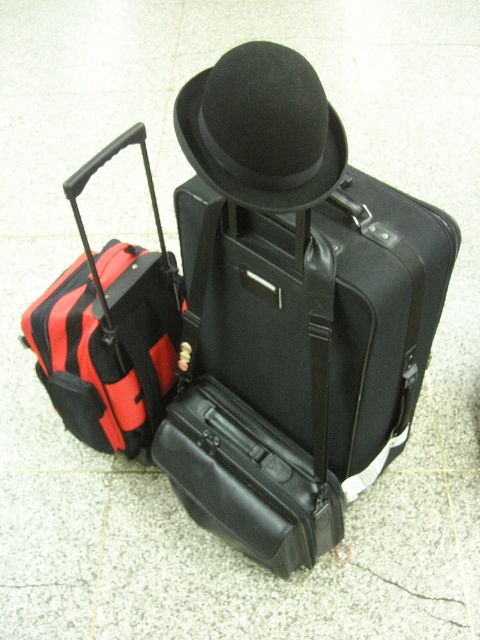
Who is more distant from viewer, (193,442) or (156,346)?

Positioned behind is point (156,346).

Is black leather suitcase at center to the right of red/black striped suitcase at left from the viewer's perspective?

Yes, black leather suitcase at center is to the right of red/black striped suitcase at left.

At what (x,y) coordinates should I click in order to perform the action: click on black leather suitcase at center. Please return your answer as a coordinate pair (x, y). The image size is (480, 640). Looking at the image, I should click on (253, 381).

The width and height of the screenshot is (480, 640). What are the coordinates of `black leather suitcase at center` in the screenshot? It's located at (253, 381).

Does black matte suitcase at center have a greater height compared to black leather suitcase at center?

No.

Which is more to the left, black matte suitcase at center or black leather suitcase at center?

black leather suitcase at center

This screenshot has width=480, height=640. What are the coordinates of `black matte suitcase at center` in the screenshot? It's located at (321, 310).

Find the location of `black matte suitcase at center`. black matte suitcase at center is located at coordinates (321, 310).

Does black matte suitcase at center have a larger size compared to black felt fedora at center?

Correct, black matte suitcase at center is larger in size than black felt fedora at center.

Between point (251, 340) and point (294, 67), which one is positioned behind?

Positioned behind is point (251, 340).

Describe the element at coordinates (321, 310) in the screenshot. I see `black matte suitcase at center` at that location.

This screenshot has width=480, height=640. What are the coordinates of `black matte suitcase at center` in the screenshot? It's located at (321, 310).